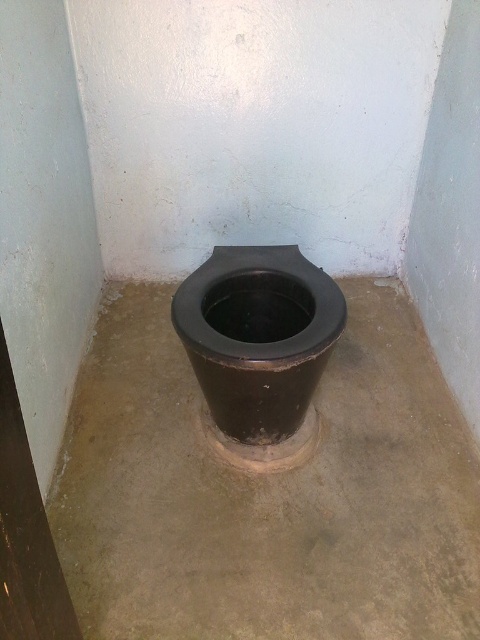
You are standing in a small toilet room with a black matte cement at center and a black matte toilet bowl at center. Which object is located to the right of the other?

The black matte cement at center is located to the right of the black matte toilet bowl at center.

Consider the image. You are a maintenance worker inspecting the toilet area. You notice the black matte cement at center and the black matte toilet bowl at center. Which object is closer to you from your current viewpoint?

The black matte cement at center is in front of the black matte toilet bowl at center, so it is closer to you.